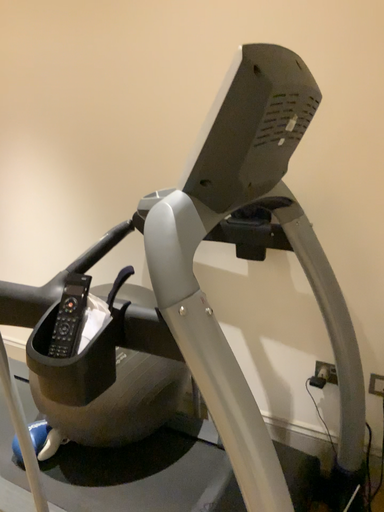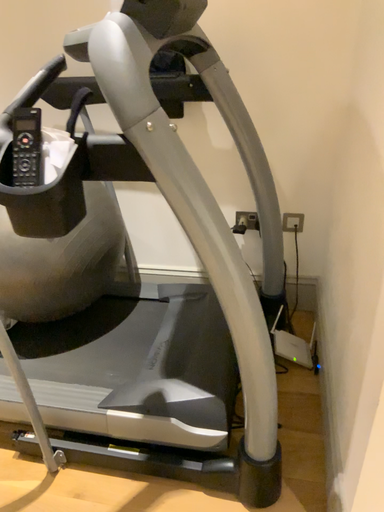
Question: How did the camera likely rotate when shooting the video?

Choices:
 (A) rotated upward
 (B) rotated downward

Answer: (B)